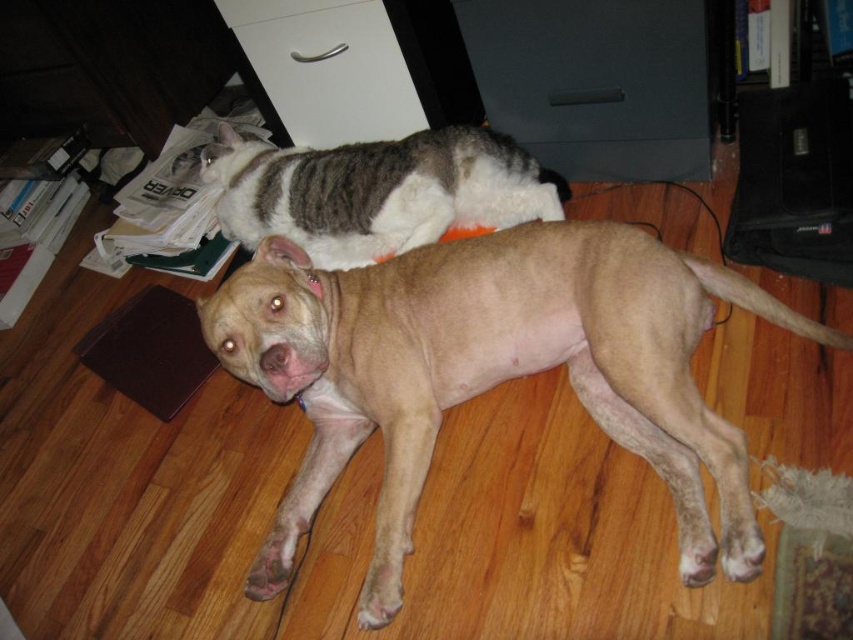
Does light brown smooth dog at center have a greater height compared to striped fur cat at upper center?

Indeed, light brown smooth dog at center has a greater height compared to striped fur cat at upper center.

Is light brown smooth dog at center shorter than striped fur cat at upper center?

No.

Find the location of `light brown smooth dog at center`. light brown smooth dog at center is located at coordinates (491, 371).

Find the location of a particular element. The width and height of the screenshot is (853, 640). light brown smooth dog at center is located at coordinates (491, 371).

Based on the photo, is light brown smooth dog at center closer to camera compared to white matte drawer at upper center?

Yes.

The height and width of the screenshot is (640, 853). I want to click on light brown smooth dog at center, so click(x=491, y=371).

Who is lower down, striped fur cat at upper center or white matte drawer at upper center?

Positioned lower is striped fur cat at upper center.

Does point (369, 172) come behind point (283, 93)?

No, it is not.

I want to click on striped fur cat at upper center, so coord(376,189).